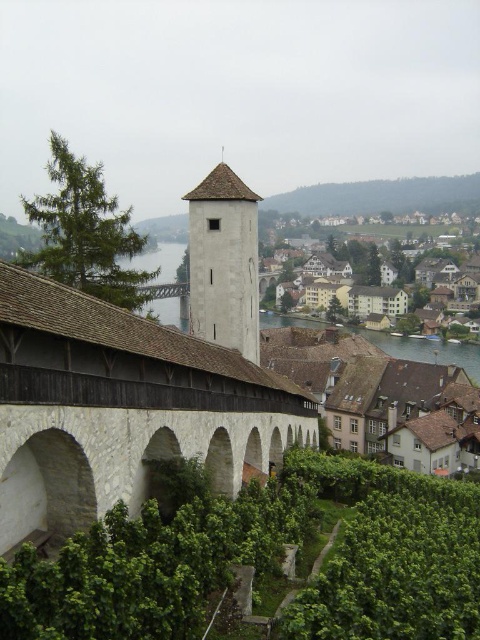
Question: In this image, where is white stone bridge at center located relative to white stone tower at center?

Choices:
 (A) above
 (B) below

Answer: (B)

Question: Does white stone bridge at center appear over white stone tower at center?

Choices:
 (A) no
 (B) yes

Answer: (A)

Question: Does white stone bridge at center lie in front of white stone tower at center?

Choices:
 (A) yes
 (B) no

Answer: (A)